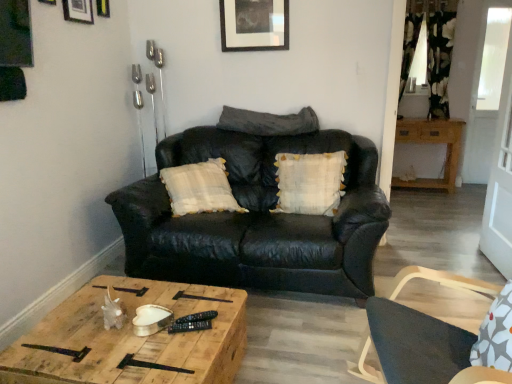
Locate an element on the screen. This screenshot has width=512, height=384. free spot above woodenmaterial/texturetable at center, placed as the second table when sorted from right to left (from a real-world perspective) is located at coordinates (135, 326).